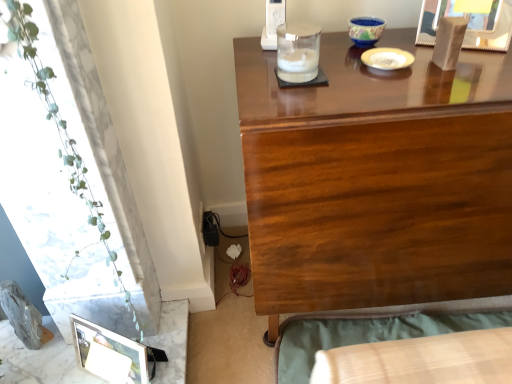
Identify the location of free space on the front side of clear glass candle holder at upper center, which is the first candle holder in bottom-to-top order. (312, 97).